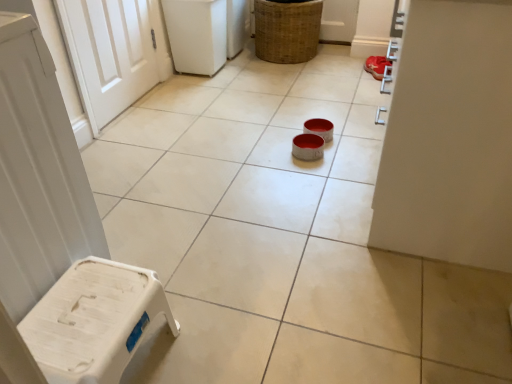
Find the location of a particular element. vacant area that lies to the right of woven brown basket at upper center is located at coordinates (335, 66).